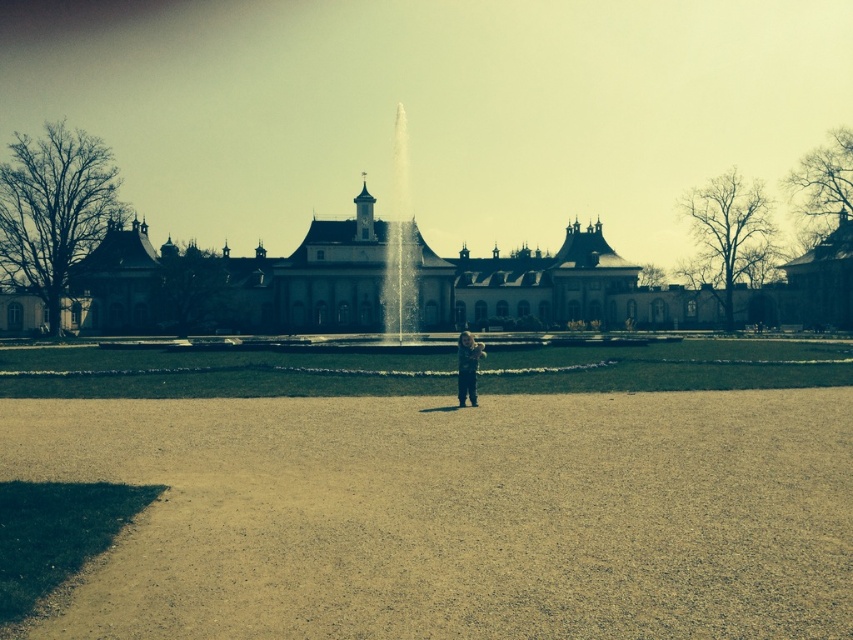
Question: Does clear glass water at center have a lesser width compared to light brown fabric child at center?

Choices:
 (A) yes
 (B) no

Answer: (B)

Question: Can you confirm if brown gravel path at center is positioned below light brown fabric child at center?

Choices:
 (A) yes
 (B) no

Answer: (A)

Question: Which point is farther to the camera?

Choices:
 (A) (386, 237)
 (B) (474, 380)
 (C) (814, 483)

Answer: (A)

Question: Estimate the real-world distances between objects in this image. Which object is farther from the brown gravel path at center?

Choices:
 (A) clear glass water at center
 (B) light brown fabric child at center

Answer: (A)

Question: Does brown gravel path at center have a smaller size compared to clear glass water at center?

Choices:
 (A) yes
 (B) no

Answer: (B)

Question: Which point appears farthest from the camera in this image?

Choices:
 (A) (396, 323)
 (B) (202, 531)
 (C) (463, 337)

Answer: (A)